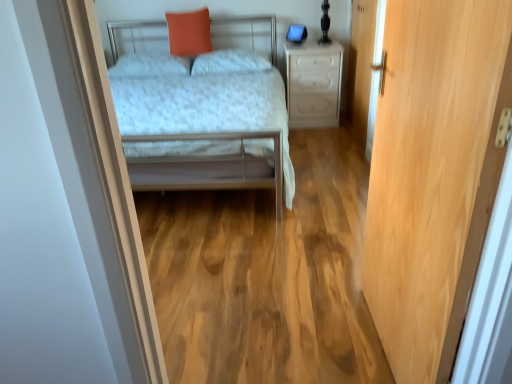
Question: From their relative heights in the image, would you say white plastic drawer at center is taller or shorter than wooden door at right?

Choices:
 (A) short
 (B) tall

Answer: (A)

Question: Is white plastic drawer at center inside the boundaries of wooden door at right, or outside?

Choices:
 (A) inside
 (B) outside

Answer: (B)

Question: Based on their relative distances, which object is farther from the light wood door at right?

Choices:
 (A) orange matte pillow at upper center
 (B) white soft pillow at center, acting as the 2th pillow starting from the right
 (C) metallic silver bed at center
 (D) wooden door at right
 (E) white plastic drawer at center

Answer: (A)

Question: Which object is positioned closest to the metallic silver bed at center?

Choices:
 (A) orange matte pillow at upper center
 (B) white plastic drawer at center
 (C) light wood door at right
 (D) white soft pillow at center, which is the first pillow in right-to-left order
 (E) wooden door at right

Answer: (D)